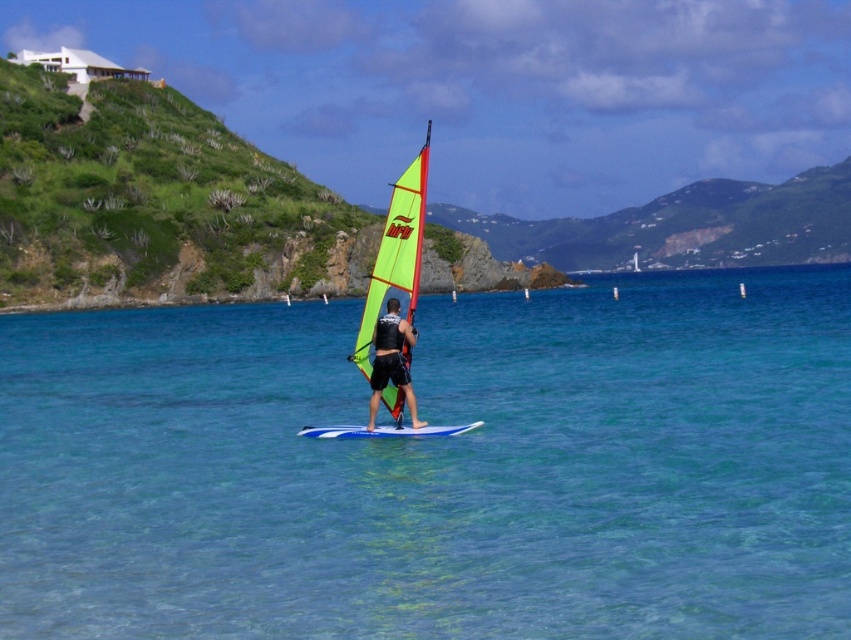
Question: Which point is farther to the camera?

Choices:
 (A) (427, 429)
 (B) (403, 328)
 (C) (46, 141)

Answer: (C)

Question: Is the position of clear blue water at center more distant than that of neon yellow sail at center?

Choices:
 (A) yes
 (B) no

Answer: (B)

Question: Is clear blue water at center smaller than matte black wetsuit at center?

Choices:
 (A) yes
 (B) no

Answer: (B)

Question: Which point is farther to the camera?

Choices:
 (A) green grassy hillside at upper left
 (B) blue glossy surfboard at center
 (C) matte black wetsuit at center
 (D) clear blue water at center

Answer: (A)

Question: Which is farther from the clear blue water at center?

Choices:
 (A) green grassy hillside at upper left
 (B) matte black wetsuit at center
 (C) blue glossy surfboard at center
 (D) neon yellow sail at center

Answer: (D)

Question: Is clear blue water at center positioned at the back of neon yellow sail at center?

Choices:
 (A) yes
 (B) no

Answer: (B)